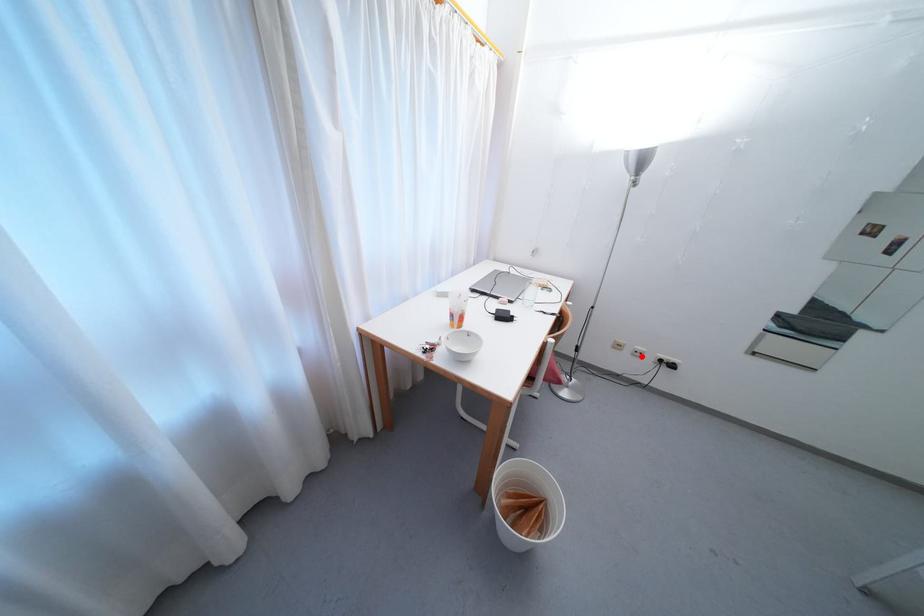
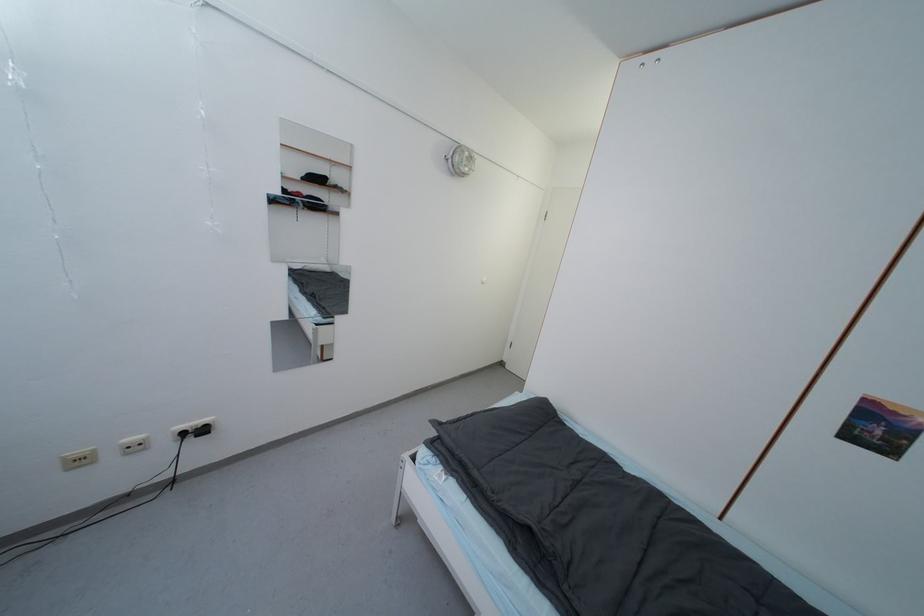
Locate, in the second image, the point that corresponds to the highlighted location in the first image.

(140, 450)